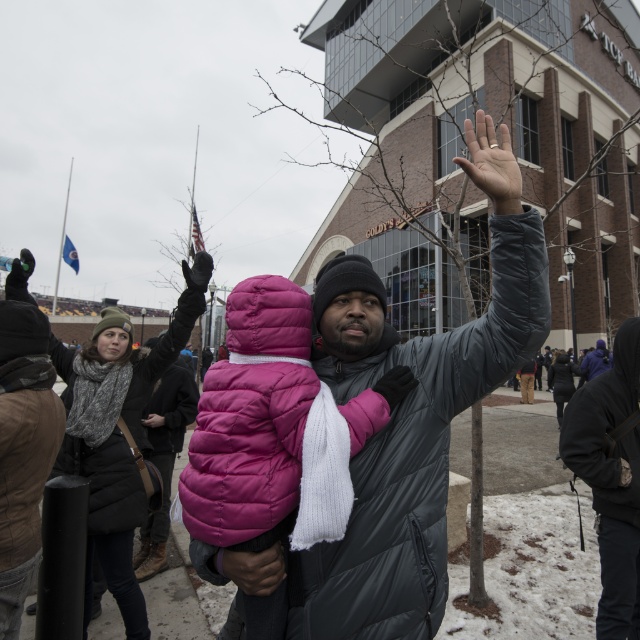
Question: Among these points, which one is nearest to the camera?

Choices:
 (A) pyautogui.click(x=204, y=262)
 (B) pyautogui.click(x=410, y=384)
 (C) pyautogui.click(x=332, y=573)
 (D) pyautogui.click(x=605, y=531)

Answer: (C)

Question: In this image, where is matte black jacket at center located relative to matte black glove at upper center?

Choices:
 (A) right
 (B) left

Answer: (A)

Question: Is dark gray hooded jacket at lower right thinner than black matte glove at upper center?

Choices:
 (A) no
 (B) yes

Answer: (A)

Question: Is pink matte/padded glove at center thinner than dark blue puffer jacket at center?

Choices:
 (A) yes
 (B) no

Answer: (A)

Question: Among these objects, which one is nearest to the camera?

Choices:
 (A) dark blue puffer jacket at center
 (B) matte black hand at upper center
 (C) matte black glove at upper center

Answer: (B)

Question: Which object appears farthest from the camera in this image?

Choices:
 (A) black matte glove at upper left
 (B) dark blue puffer jacket at center
 (C) black matte glove at upper center
 (D) pink matte/padded glove at center

Answer: (B)